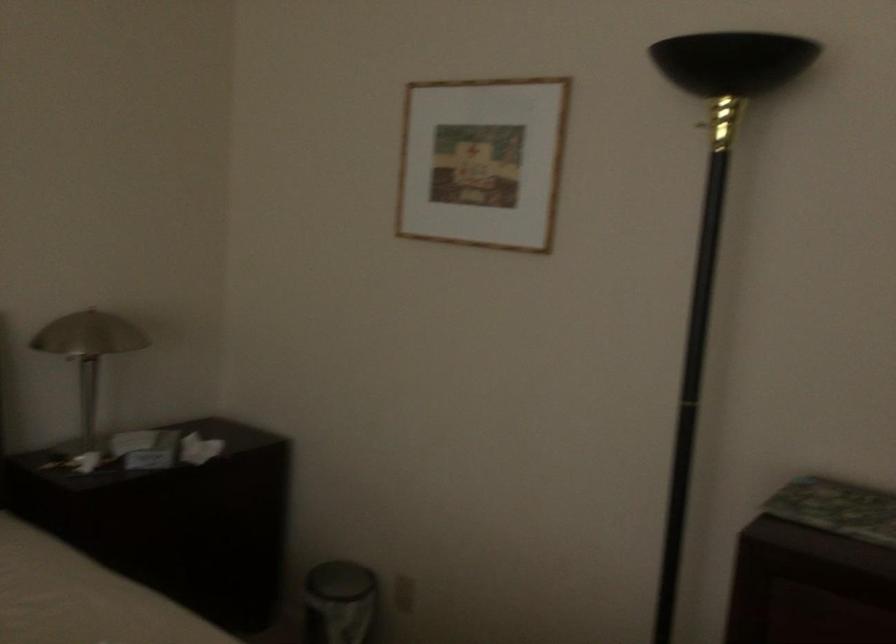
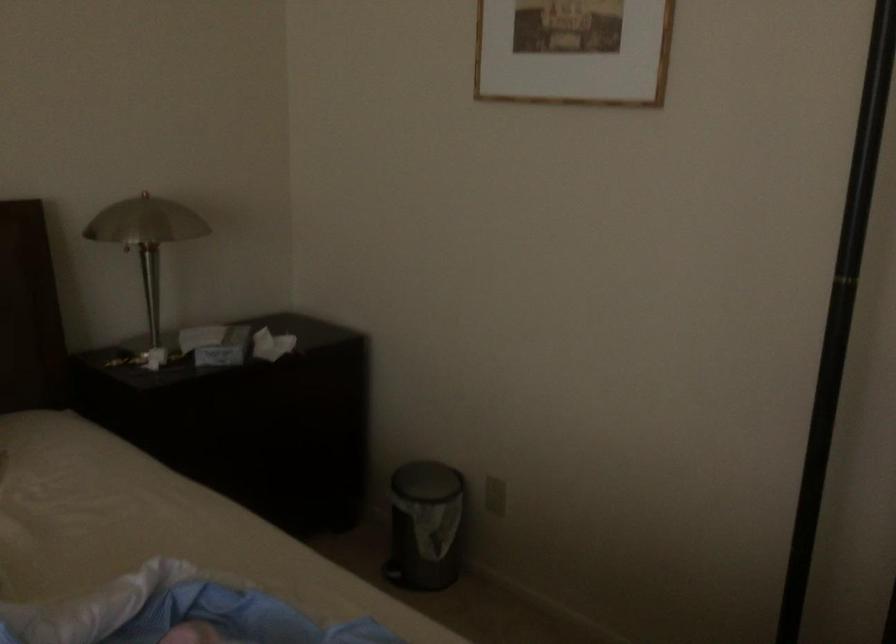
Question: Based on the continuous images, in which direction is the camera rotating? Reply with the corresponding letter.

Choices:
 (A) Left
 (B) Right
 (C) Up
 (D) Down

Answer: (D)